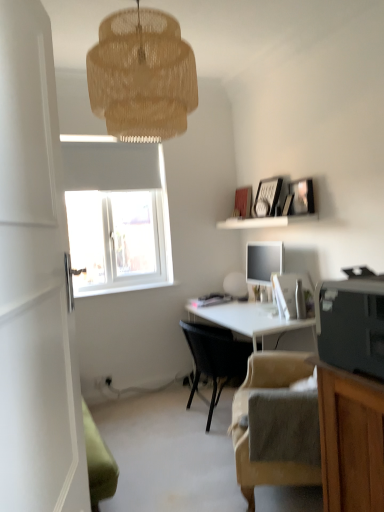
Question: Is woven beige lampshade at upper center closer to the viewer compared to white glossy door at left?

Choices:
 (A) no
 (B) yes

Answer: (A)

Question: Is woven beige lampshade at upper center positioned far away from white glossy door at left?

Choices:
 (A) no
 (B) yes

Answer: (B)

Question: Is woven beige lampshade at upper center at the left side of white glossy door at left?

Choices:
 (A) no
 (B) yes

Answer: (A)

Question: Considering the relative sizes of woven beige lampshade at upper center and white glossy door at left in the image provided, is woven beige lampshade at upper center bigger than white glossy door at left?

Choices:
 (A) yes
 (B) no

Answer: (A)

Question: Is woven beige lampshade at upper center smaller than white glossy door at left?

Choices:
 (A) yes
 (B) no

Answer: (B)

Question: Is woven beige lampshade at upper center facing towards white glossy door at left?

Choices:
 (A) no
 (B) yes

Answer: (A)

Question: Does white glossy door at left have a smaller size compared to black plastic printer at lower right?

Choices:
 (A) yes
 (B) no

Answer: (B)

Question: Are white glossy door at left and black plastic printer at lower right far apart?

Choices:
 (A) no
 (B) yes

Answer: (A)

Question: Does white glossy door at left appear on the left side of black plastic printer at lower right?

Choices:
 (A) yes
 (B) no

Answer: (A)

Question: Does white glossy door at left have a lesser width compared to black plastic printer at lower right?

Choices:
 (A) no
 (B) yes

Answer: (B)

Question: Is white glossy door at left not inside black plastic printer at lower right?

Choices:
 (A) yes
 (B) no

Answer: (A)

Question: Is white glossy door at left facing away from black plastic printer at lower right?

Choices:
 (A) yes
 (B) no

Answer: (B)

Question: From a real-world perspective, is woven beige lampshade at upper center located beneath beige fabric chair at lower right, the second chair from the back?

Choices:
 (A) no
 (B) yes

Answer: (A)